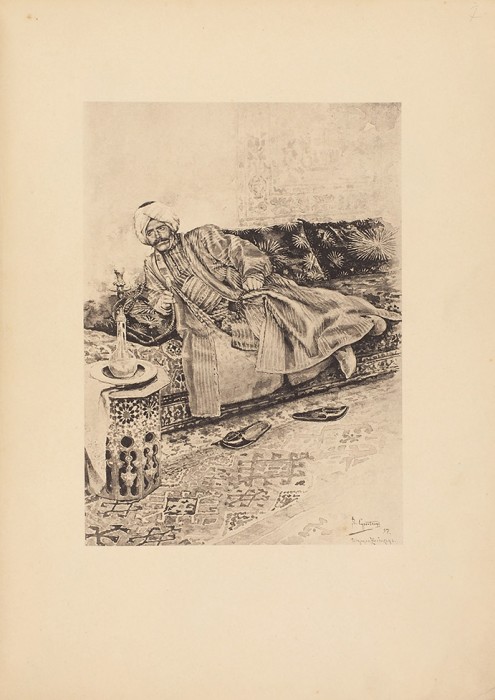
Find the location of a particular element. The width and height of the screenshot is (495, 700). hookah pipe hose is located at coordinates (164, 334), (138, 666).